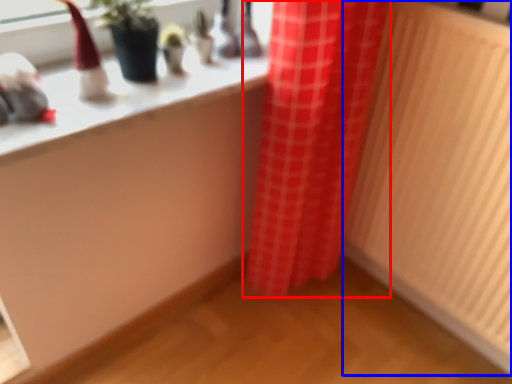
Question: Which of the following is the closest to the observer, curtain (highlighted by a red box) or radiator (highlighted by a blue box)?

Choices:
 (A) curtain
 (B) radiator

Answer: (B)